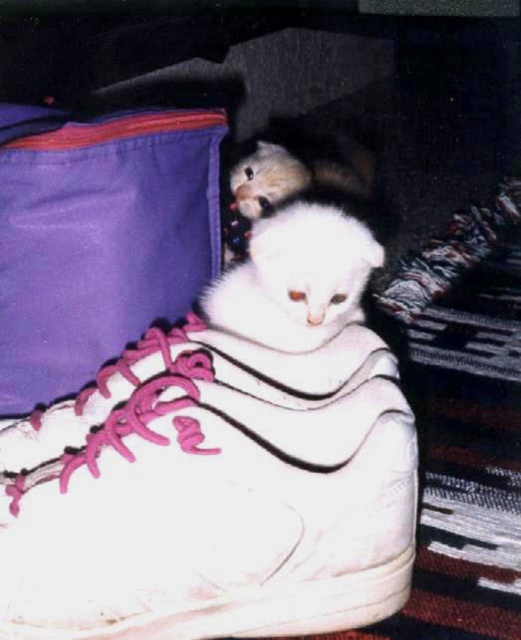
Does point (252, 454) come farther from viewer compared to point (299, 328)?

No, it is not.

Is point (185, 348) farther from viewer compared to point (259, 323)?

No, (185, 348) is in front of (259, 323).

Identify the location of white matte sneaker at center. This screenshot has height=640, width=521. (212, 493).